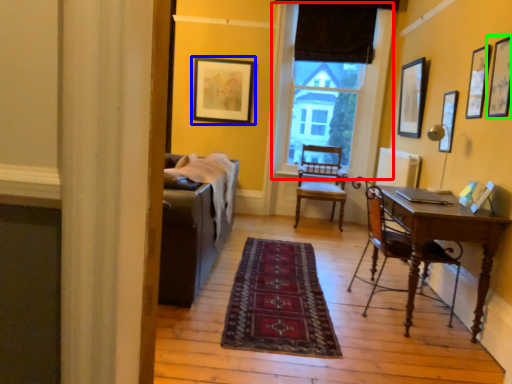
Question: Which object is the closest to the window (highlighted by a red box)? Choose among these: picture frame (highlighted by a blue box) or picture frame (highlighted by a green box).

Choices:
 (A) picture frame
 (B) picture frame

Answer: (A)